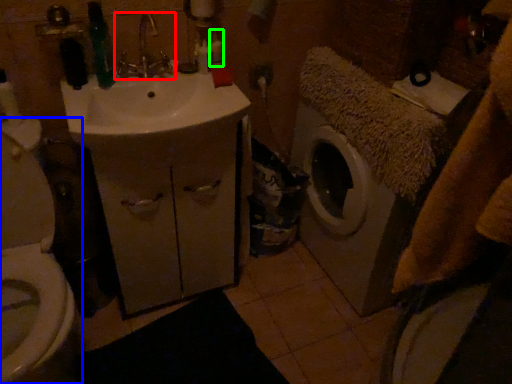
Question: Which object is positioned closest to tap (highlighted by a red box)? Select from toilet (highlighted by a blue box) and toiletry (highlighted by a green box).

Choices:
 (A) toilet
 (B) toiletry

Answer: (B)